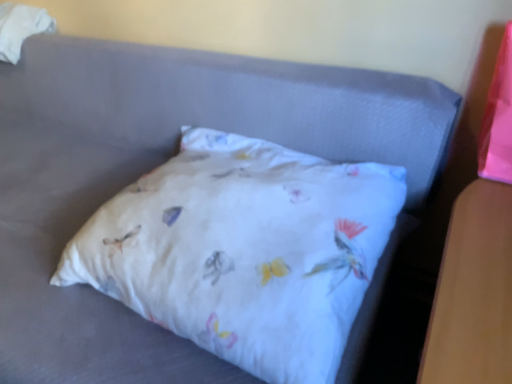
Identify the location of white fabric pillow at center. The width and height of the screenshot is (512, 384). (244, 250).

Describe the element at coordinates (244, 250) in the screenshot. I see `white fabric pillow at center` at that location.

The height and width of the screenshot is (384, 512). In order to click on white fabric at upper left in this screenshot , I will do `click(20, 28)`.

The image size is (512, 384). Describe the element at coordinates (20, 28) in the screenshot. I see `white fabric at upper left` at that location.

Where is `white fabric pillow at center`? This screenshot has height=384, width=512. white fabric pillow at center is located at coordinates (244, 250).

Is white fabric at upper left to the left of white fabric pillow at center from the viewer's perspective?

Correct, you'll find white fabric at upper left to the left of white fabric pillow at center.

In the scene shown: In the image, is white fabric at upper left positioned in front of or behind white fabric pillow at center?

Visually, white fabric at upper left is located behind white fabric pillow at center.

Is point (15, 57) behind point (259, 246)?

Yes.

From the image's perspective, which one is positioned higher, white fabric at upper left or white fabric pillow at center?

From the image's view, white fabric at upper left is above.

From a real-world perspective, is white fabric at upper left positioned under white fabric pillow at center based on gravity?

No, from a real-world perspective, white fabric at upper left is not under white fabric pillow at center.

In terms of width, does white fabric at upper left look wider or thinner when compared to white fabric pillow at center?

Clearly, white fabric at upper left has less width compared to white fabric pillow at center.

Who is taller, white fabric at upper left or white fabric pillow at center?

With more height is white fabric at upper left.

Considering the relative sizes of white fabric at upper left and white fabric pillow at center in the image provided, is white fabric at upper left bigger than white fabric pillow at center?

No.

Is white fabric at upper left not within white fabric pillow at center?

Yes, white fabric at upper left is not within white fabric pillow at center.

Is white fabric at upper left positioned far away from white fabric pillow at center?

Absolutely, white fabric at upper left is distant from white fabric pillow at center.

Does white fabric at upper left turn towards white fabric pillow at center?

No.

Find the location of a particular element. This screenshot has width=512, height=384. pillow below the white fabric at upper left (from a real-world perspective) is located at coordinates point(244,250).

Is white fabric pillow at center to the left of white fabric at upper left from the viewer's perspective?

In fact, white fabric pillow at center is to the right of white fabric at upper left.

Between white fabric pillow at center and white fabric at upper left, which one is positioned behind?

white fabric at upper left is further from the camera.

Is point (321, 173) farther from viewer compared to point (22, 22)?

No, (321, 173) is closer to viewer.

From the image's perspective, is white fabric pillow at center located above white fabric at upper left?

Incorrect, from the image's perspective, white fabric pillow at center is lower than white fabric at upper left.

From a real-world perspective, is white fabric pillow at center located higher than white fabric at upper left?

Actually, white fabric pillow at center is physically below white fabric at upper left in the real world.

Which of these two, white fabric pillow at center or white fabric at upper left, is wider?

With larger width is white fabric pillow at center.

Considering the relative sizes of white fabric pillow at center and white fabric at upper left in the image provided, is white fabric pillow at center shorter than white fabric at upper left?

Yes, white fabric pillow at center is shorter than white fabric at upper left.

Is white fabric pillow at center bigger than white fabric at upper left?

Yes, white fabric pillow at center is bigger than white fabric at upper left.

Is white fabric at upper left a part of white fabric pillow at center?

No, white fabric at upper left is located outside of white fabric pillow at center.

Does white fabric pillow at center touch white fabric at upper left?

There is a gap between white fabric pillow at center and white fabric at upper left.

Could you tell me if white fabric pillow at center is facing white fabric at upper left?

No, white fabric pillow at center is not aimed at white fabric at upper left.

What are the coordinates of `material that is above the white fabric pillow at center (from a real-world perspective)` in the screenshot? It's located at click(x=20, y=28).

Locate an element on the screen. The width and height of the screenshot is (512, 384). material that appears above the white fabric pillow at center (from the image's perspective) is located at coordinates (20, 28).

This screenshot has height=384, width=512. I want to click on pillow lying on the right of white fabric at upper left, so click(244, 250).